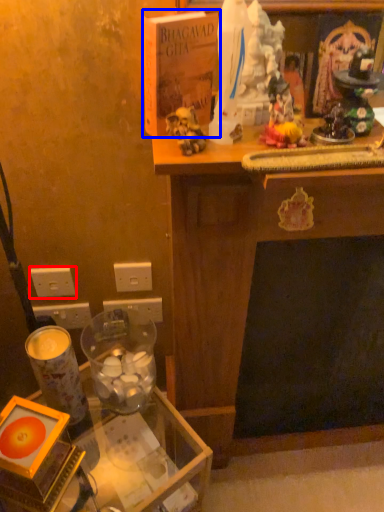
Question: Which point is further to the camera, electric outlet (highlighted by a red box) or book (highlighted by a blue box)?

Choices:
 (A) electric outlet
 (B) book

Answer: (A)